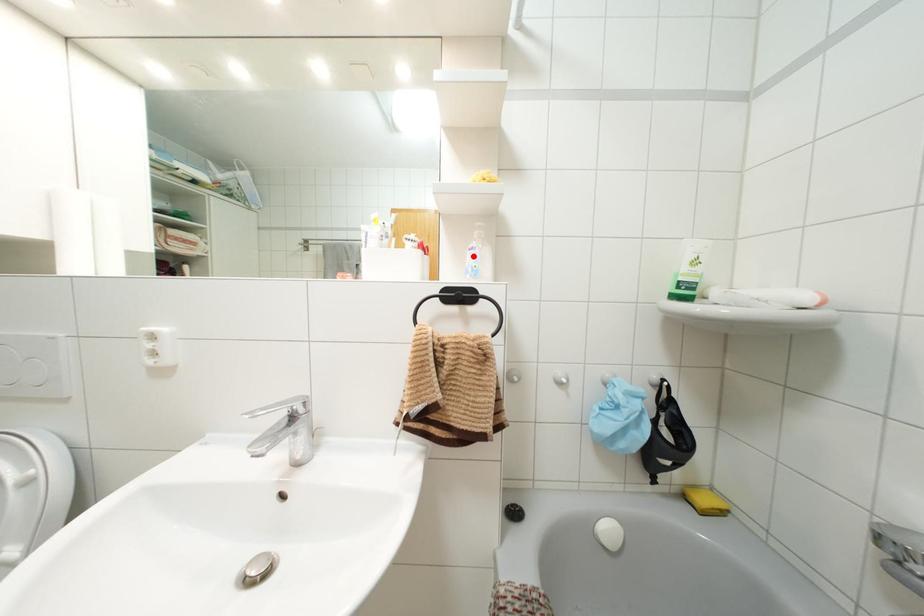
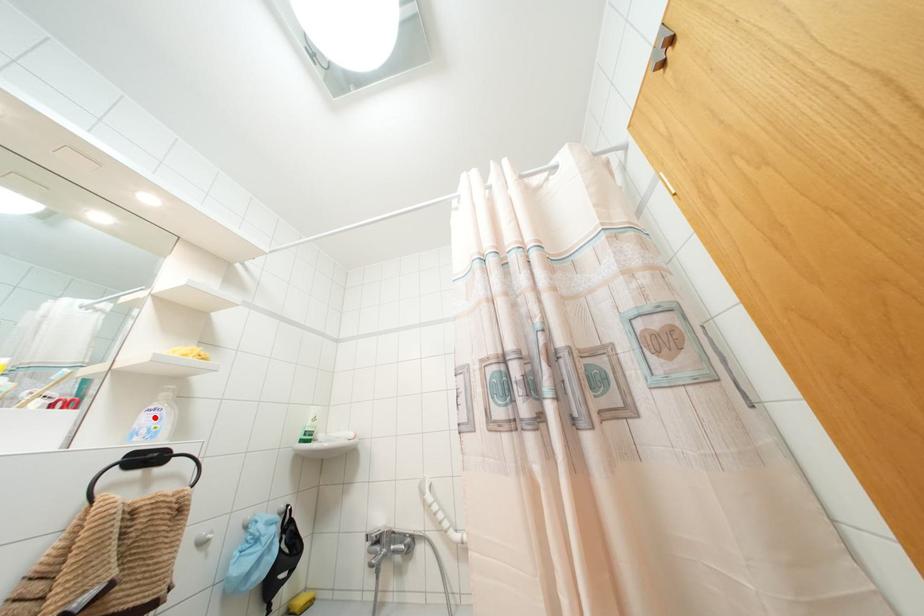
From the picture: I am providing you with two images of the same scene from different viewpoints. A red point is marked on the first image and another point is marked on the second image. Are the points marked in image1 and image2 representing the same 3D position?

Yes